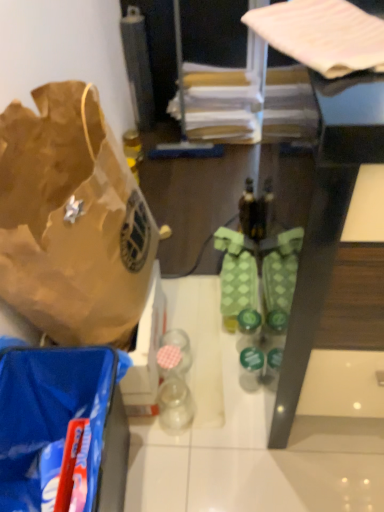
Question: Is brown paper bag at left to the left or to the right of pink fabric at upper right, the 1th wrapping paper in the front-to-back sequence, in the image?

Choices:
 (A) left
 (B) right

Answer: (A)

Question: In the image, is brown paper bag at left positioned in front of or behind pink fabric at upper right, placed as the second wrapping paper when sorted from top to bottom?

Choices:
 (A) behind
 (B) front

Answer: (A)

Question: Based on their relative distances, which object is farther from the matte brown wrapping paper at upper center, which is counted as the 1th wrapping paper, starting from the back?

Choices:
 (A) brown paper bag at left
 (B) pink fabric at upper right, the 1th wrapping paper in the front-to-back sequence
 (C) green matte bottle at center
 (D) blue plastic bag at lower left

Answer: (D)

Question: Which of these objects is positioned farthest from the pink fabric at upper right, the 1th wrapping paper in the front-to-back sequence?

Choices:
 (A) green matte bottle at center
 (B) blue plastic bag at lower left
 (C) brown paper bag at left
 (D) matte brown wrapping paper at upper center, which is counted as the 1th wrapping paper, starting from the back

Answer: (D)